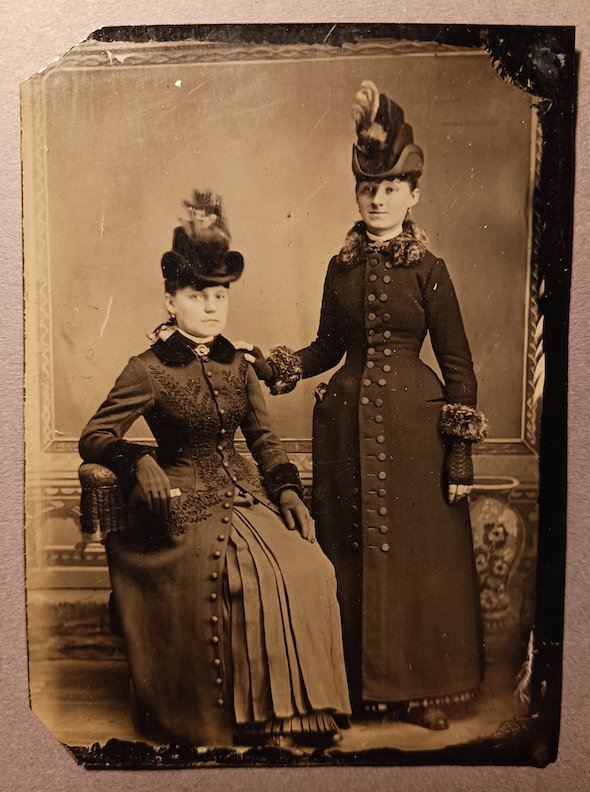
The width and height of the screenshot is (590, 792). Identify the location of photograph holder. (40, 767).